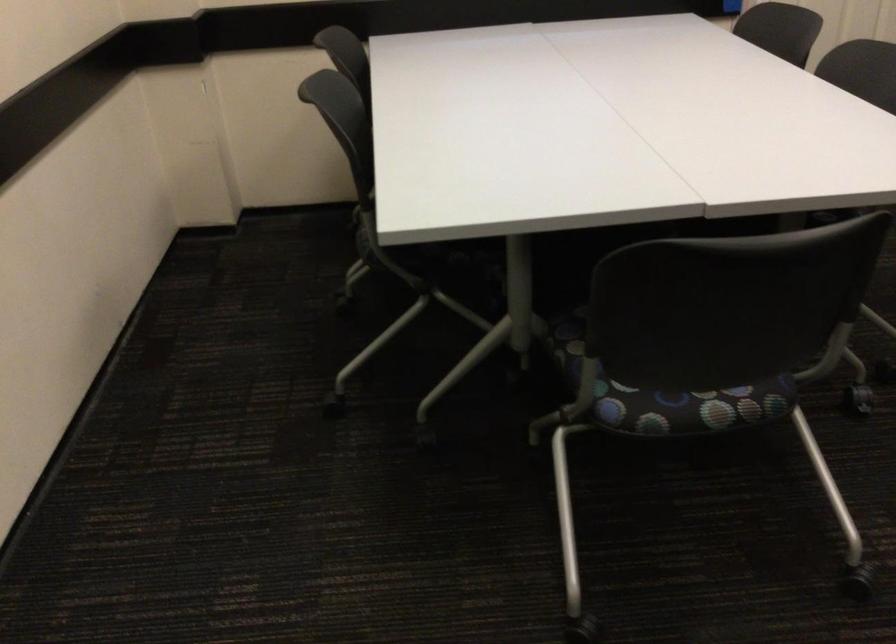
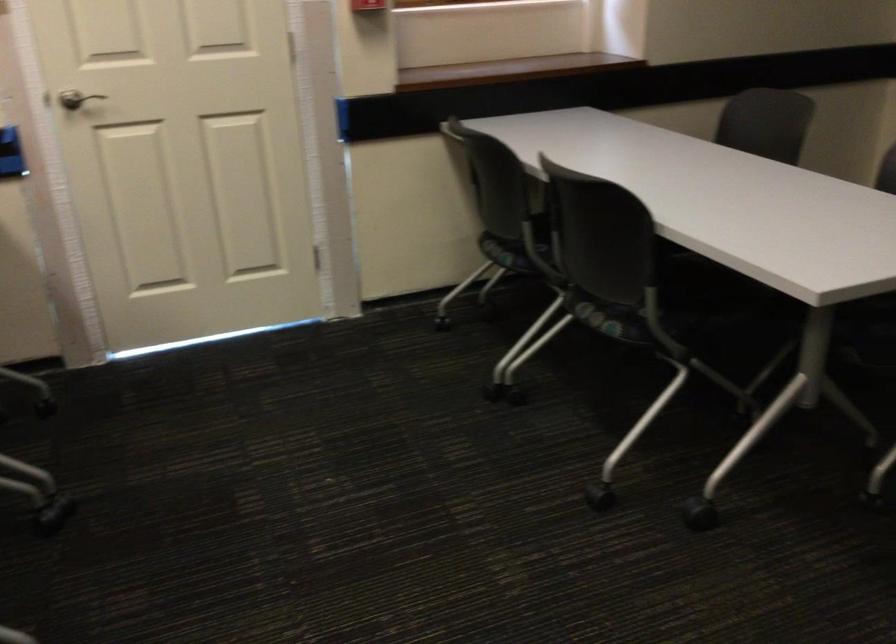
Question: What movement of the cameraman would produce the second image?

Choices:
 (A) Left
 (B) Right
 (C) Forward
 (D) Backward

Answer: (B)